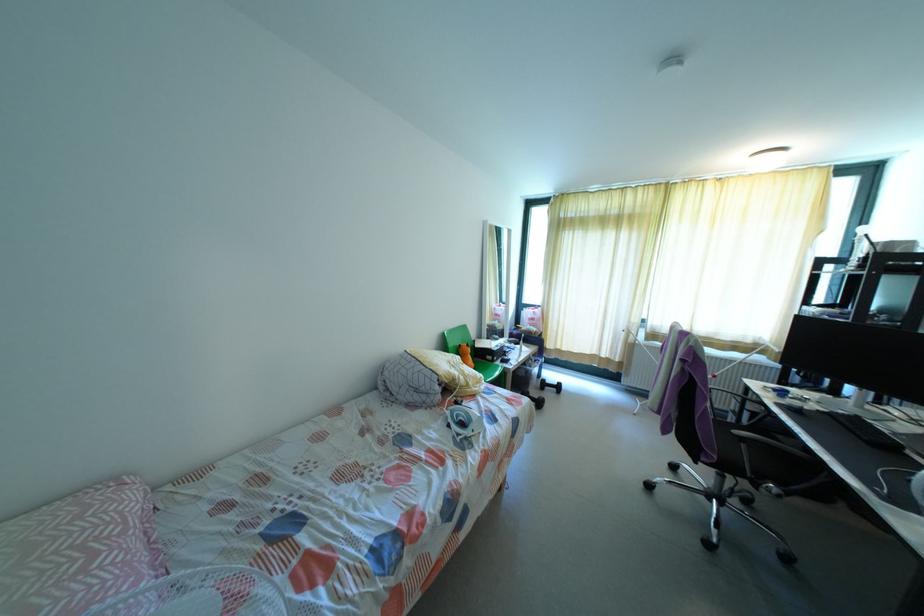
You are a GUI agent. You are given a task and a screenshot of the screen. Output one action in this format:
    pyautogui.click(x=<x>, y=<y>)
    Task: Click on the green chair sitting surface
    This screenshot has width=924, height=616.
    Given the screenshot: What is the action you would take?
    pyautogui.click(x=484, y=369)